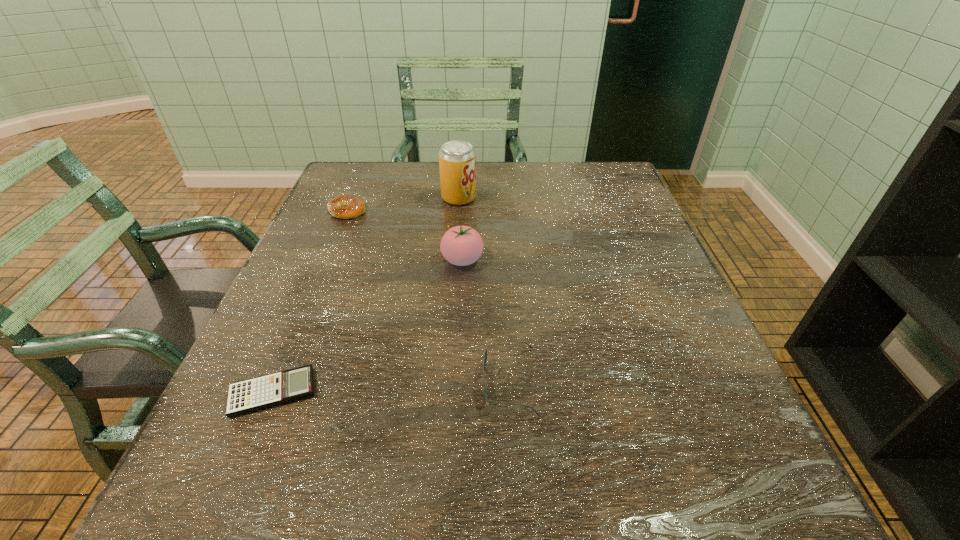
Image resolution: width=960 pixels, height=540 pixels. I want to click on the tallest object, so click(x=457, y=159).

At what (x,y) coordinates should I click in order to perform the action: click on the third farthest object. Please return your answer as a coordinate pair (x, y). The width and height of the screenshot is (960, 540). Looking at the image, I should click on (461, 245).

Where is `the second tallest object`? the second tallest object is located at coordinates (461, 245).

You are a GUI agent. You are given a task and a screenshot of the screen. Output one action in this format:
    pyautogui.click(x=<x>, y=<y>)
    Task: Click on the sunglasses
    This screenshot has height=540, width=960.
    Given the screenshot: What is the action you would take?
    pyautogui.click(x=485, y=354)

This screenshot has height=540, width=960. I want to click on bagel, so click(x=346, y=206).

The width and height of the screenshot is (960, 540). In order to click on calculator in this screenshot , I will do `click(246, 396)`.

I want to click on free spot located 0.370m on the right of the pop (soda), so click(617, 198).

You are a GUI agent. You are given a task and a screenshot of the screen. Output one action in this format:
    pyautogui.click(x=<x>, y=<y>)
    Task: Click on the blank space located on the right of the third nearest object
    This screenshot has height=540, width=960.
    Given the screenshot: What is the action you would take?
    pyautogui.click(x=603, y=260)

I want to click on vacant space situated on the lenses of the third shortest object, so click(x=256, y=381).

Locate an element on the screen. Image resolution: width=960 pixels, height=540 pixels. free space located 0.350m on the lenses of the third shortest object is located at coordinates (269, 381).